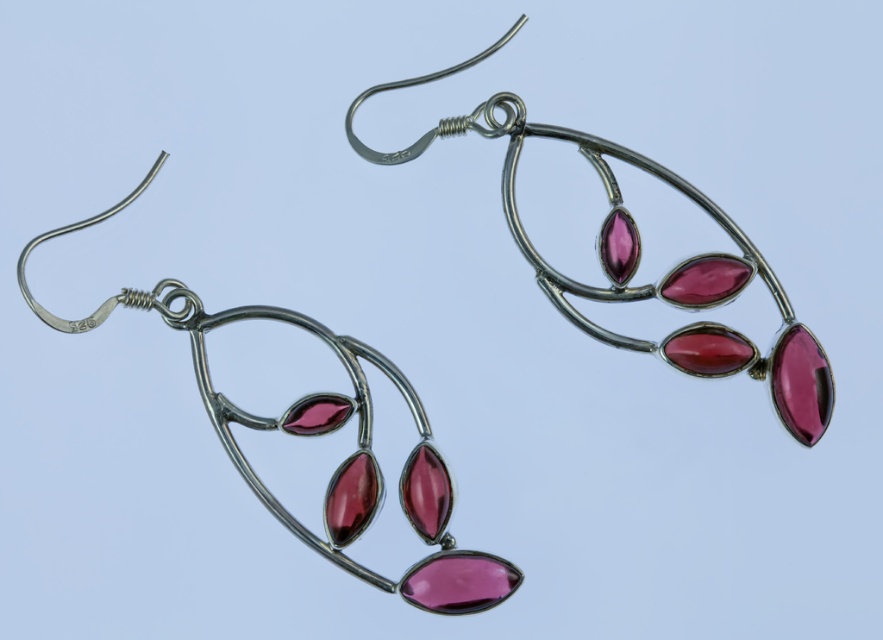
Question: Which object appears closest to the camera in this image?

Choices:
 (A) matte silver earrings at center
 (B) matte silver earrings at left

Answer: (B)

Question: Is matte silver earrings at center bigger than matte silver earrings at left?

Choices:
 (A) yes
 (B) no

Answer: (A)

Question: Which object is farther from the camera taking this photo?

Choices:
 (A) matte silver earrings at center
 (B) matte silver earrings at left

Answer: (A)

Question: Which point is farther from the camera taking this photo?

Choices:
 (A) (272, 502)
 (B) (495, 131)

Answer: (B)

Question: In this image, where is matte silver earrings at center located relative to matte silver earrings at left?

Choices:
 (A) right
 (B) left

Answer: (A)

Question: Does matte silver earrings at center lie behind matte silver earrings at left?

Choices:
 (A) yes
 (B) no

Answer: (A)